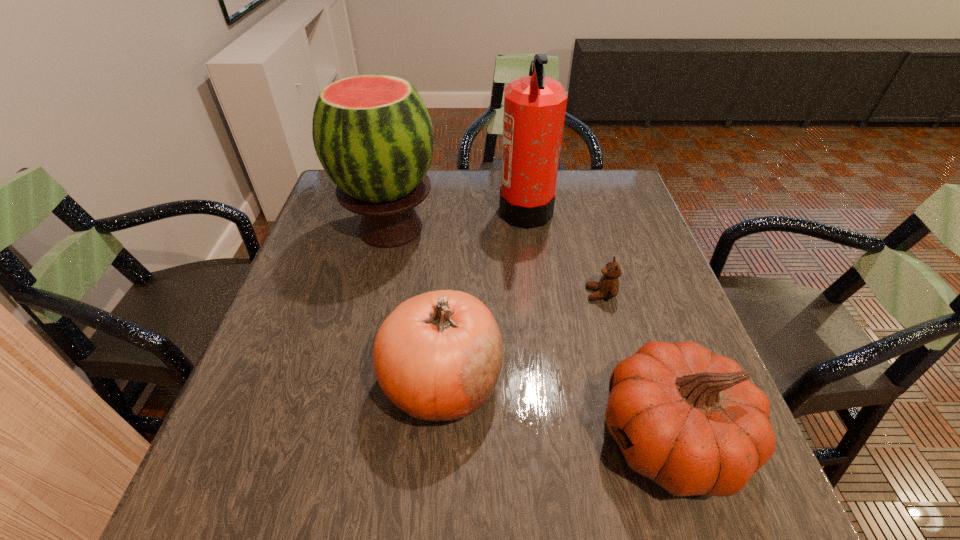
Identify the location of vacant space at the far right corner. The image size is (960, 540). (580, 180).

At what (x,y) coordinates should I click in order to perform the action: click on free space at the near right corner of the desktop. Please return your answer as a coordinate pair (x, y). The image size is (960, 540). Looking at the image, I should click on (708, 521).

Locate an element on the screen. The width and height of the screenshot is (960, 540). free space between the shortest object and the fourth shortest object is located at coordinates (495, 261).

What are the coordinates of `empty location between the left pumpkin and the shortest object` in the screenshot? It's located at (521, 338).

Locate an element on the screen. The width and height of the screenshot is (960, 540). empty space that is in between the left pumpkin and the fire extinguisher is located at coordinates (484, 295).

The width and height of the screenshot is (960, 540). I want to click on vacant area between the left pumpkin and the right pumpkin, so click(556, 409).

You are a GUI agent. You are given a task and a screenshot of the screen. Output one action in this format:
    pyautogui.click(x=<x>, y=<y>)
    Task: Click on the free space between the third object from right to left and the shortest object
    The height and width of the screenshot is (540, 960).
    Given the screenshot: What is the action you would take?
    pyautogui.click(x=563, y=251)

Image resolution: width=960 pixels, height=540 pixels. In order to click on unoccupied area between the left pumpkin and the fire extinguisher in this screenshot , I will do `click(484, 295)`.

Identify the location of vacant area that lies between the fire extinguisher and the watermelon. This screenshot has height=540, width=960. (458, 219).

Locate an element on the screen. blank region between the teddy bear and the fourth shortest object is located at coordinates (495, 261).